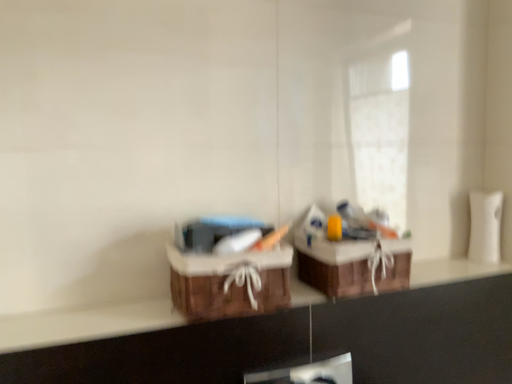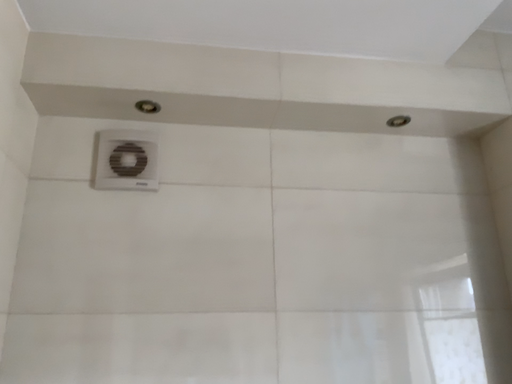
Question: Which way did the camera rotate in the video?

Choices:
 (A) rotated right
 (B) rotated left

Answer: (B)